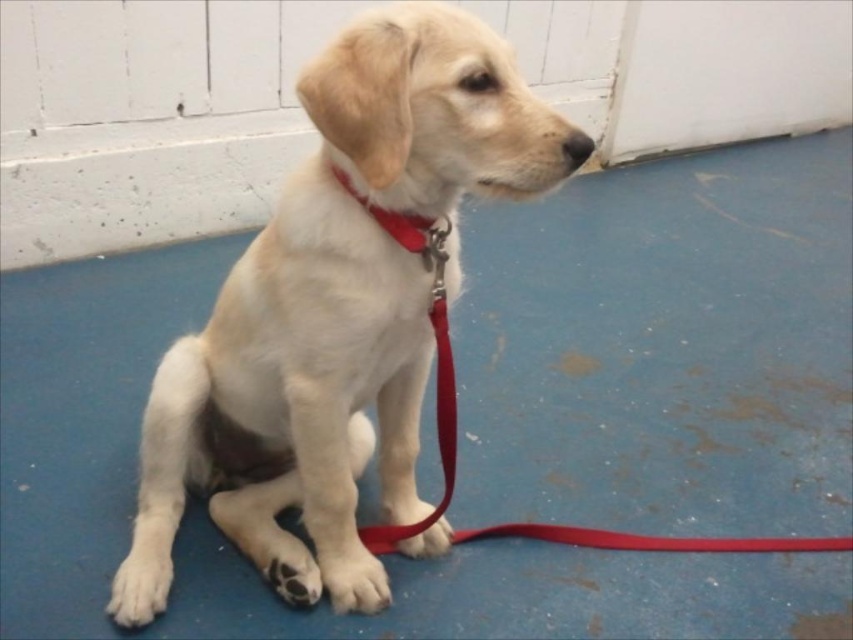
Question: Does white fur dog at center have a larger size compared to matte nylon collar at center?

Choices:
 (A) no
 (B) yes

Answer: (B)

Question: Is red leather leash at center bigger than matte nylon collar at center?

Choices:
 (A) yes
 (B) no

Answer: (A)

Question: Which point appears farthest from the camera in this image?

Choices:
 (A) (398, 532)
 (B) (408, 228)

Answer: (A)

Question: Is the position of red leather leash at center more distant than that of matte nylon collar at center?

Choices:
 (A) yes
 (B) no

Answer: (A)

Question: Which point appears closest to the camera in this image?

Choices:
 (A) (293, 305)
 (B) (413, 227)
 (C) (364, 541)

Answer: (B)

Question: Among these points, which one is nearest to the camera?

Choices:
 (A) (155, 426)
 (B) (396, 214)
 (C) (418, 529)

Answer: (B)